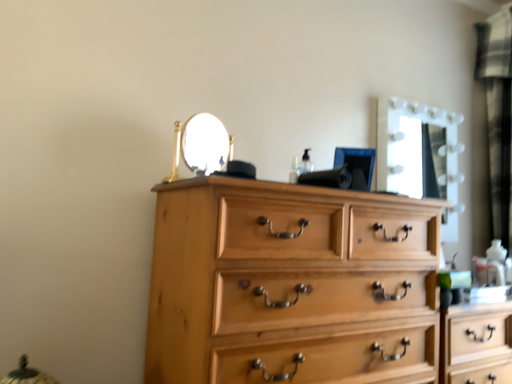
What do you see at coordinates (290, 285) in the screenshot?
I see `natural wood chest of drawers at center` at bounding box center [290, 285].

The height and width of the screenshot is (384, 512). What are the coordinates of `natural wood chest of drawers at center` in the screenshot? It's located at (290, 285).

Find the location of a particular element. The height and width of the screenshot is (384, 512). natural wood chest of drawers at center is located at coordinates (290, 285).

Which of these two, white glossy mirror at upper right or black textured curtain at right, stands shorter?

Standing shorter between the two is white glossy mirror at upper right.

Is white glossy mirror at upper right facing away from black textured curtain at right?

That's not correct — white glossy mirror at upper right is not looking away from black textured curtain at right.

Considering the sizes of objects white glossy mirror at upper right and black textured curtain at right in the image provided, who is smaller, white glossy mirror at upper right or black textured curtain at right?

black textured curtain at right is smaller.

Does white glossy mirror at upper right contain black textured curtain at right?

No.

This screenshot has width=512, height=384. I want to click on the chest of drawers located in front of the white glossy mirror at upper right, so click(290, 285).

Considering the positions of objects natural wood chest of drawers at center and white glossy mirror at upper right in the image provided, who is behind, natural wood chest of drawers at center or white glossy mirror at upper right?

white glossy mirror at upper right is more distant.

Does natural wood chest of drawers at center have a lesser width compared to white glossy mirror at upper right?

Incorrect, the width of natural wood chest of drawers at center is not less than that of white glossy mirror at upper right.

How distant is natural wood chest of drawers at center from white glossy mirror at upper right?

natural wood chest of drawers at center and white glossy mirror at upper right are 34.10 inches apart.

Could natural wood chest of drawers at center be considered to be inside black textured curtain at right?

No, natural wood chest of drawers at center is located outside of black textured curtain at right.

What's the angular difference between black textured curtain at right and natural wood chest of drawers at center's facing directions?

There is a 91-degree angle between the facing directions of black textured curtain at right and natural wood chest of drawers at center.

Does point (498, 142) come behind point (289, 312)?

Yes, point (498, 142) is farther from viewer.

Between black textured curtain at right and natural wood chest of drawers at center, which one has less height?

Standing shorter between the two is natural wood chest of drawers at center.

From the image's perspective, is white glossy mirror at upper right positioned above or below natural wood chest of drawers at center?

From the image's perspective, white glossy mirror at upper right appears above natural wood chest of drawers at center.

Between white glossy mirror at upper right and natural wood chest of drawers at center, which one appears on the right side from the viewer's perspective?

Positioned to the right is white glossy mirror at upper right.

Considering the positions of points (448, 219) and (175, 239), is point (448, 219) closer to camera compared to point (175, 239)?

No, it is behind (175, 239).

From the image's perspective, which one is positioned lower, black textured curtain at right or white glossy mirror at upper right?

white glossy mirror at upper right.

You are a GUI agent. You are given a task and a screenshot of the screen. Output one action in this format:
    pyautogui.click(x=<x>, y=<y>)
    Task: Click on the mirror lying below the black textured curtain at right (from the image's perspective)
    
    Given the screenshot: What is the action you would take?
    pyautogui.click(x=420, y=155)

Could you tell me if black textured curtain at right is turned towards white glossy mirror at upper right?

Yes, black textured curtain at right faces towards white glossy mirror at upper right.

Is black textured curtain at right wider than white glossy mirror at upper right?

Yes, black textured curtain at right is wider than white glossy mirror at upper right.

Is natural wood chest of drawers at center next to black textured curtain at right and touching it?

natural wood chest of drawers at center and black textured curtain at right are not in contact.

From the image's perspective, which is above, natural wood chest of drawers at center or black textured curtain at right?

From the image's view, black textured curtain at right is above.

Considering the relative sizes of natural wood chest of drawers at center and black textured curtain at right in the image provided, is natural wood chest of drawers at center thinner than black textured curtain at right?

No.

Considering the positions of objects natural wood chest of drawers at center and black textured curtain at right in the image provided, who is in front, natural wood chest of drawers at center or black textured curtain at right?

natural wood chest of drawers at center is more forward.

Where is `curtain located on the right of white glossy mirror at upper right`? The width and height of the screenshot is (512, 384). curtain located on the right of white glossy mirror at upper right is located at coordinates (498, 115).

Identify the location of chest of drawers in front of the white glossy mirror at upper right. This screenshot has width=512, height=384. (290, 285).

Estimate the real-world distances between objects in this image. Which object is closer to black textured curtain at right, natural wood chest of drawers at center or white glossy mirror at upper right?

Among the two, white glossy mirror at upper right is located nearer to black textured curtain at right.

Based on their spatial positions, is natural wood chest of drawers at center or black textured curtain at right further from white glossy mirror at upper right?

natural wood chest of drawers at center.

When comparing their distances from natural wood chest of drawers at center, does black textured curtain at right or white glossy mirror at upper right seem further?

black textured curtain at right lies further to natural wood chest of drawers at center than the other object.

From the image, which object appears to be farther from white glossy mirror at upper right, black textured curtain at right or natural wood chest of drawers at center?

natural wood chest of drawers at center is positioned further to the anchor white glossy mirror at upper right.

Considering their positions, is white glossy mirror at upper right positioned closer to natural wood chest of drawers at center than black textured curtain at right?

Among the two, white glossy mirror at upper right is located nearer to natural wood chest of drawers at center.

Which object lies nearer to the anchor point black textured curtain at right, white glossy mirror at upper right or natural wood chest of drawers at center?

white glossy mirror at upper right is closer to black textured curtain at right.

You are a GUI agent. You are given a task and a screenshot of the screen. Output one action in this format:
    pyautogui.click(x=<x>, y=<y>)
    Task: Click on the mirror positioned between natural wood chest of drawers at center and black textured curtain at right from near to far
    
    Given the screenshot: What is the action you would take?
    pyautogui.click(x=420, y=155)